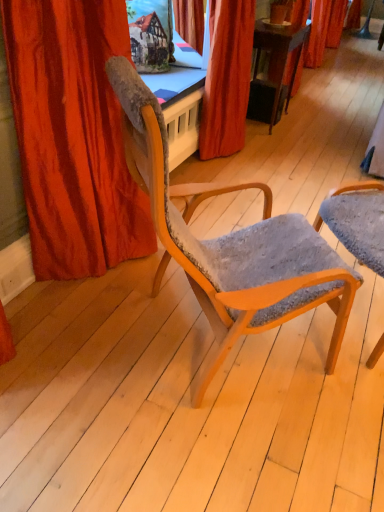
At what (x,y) coordinates should I click in order to perform the action: click on free spot below wooden chair with textured fabric at center, the 1th chair in the left-to-right sequence (from a real-world perspective). Please return your answer as a coordinate pair (x, y). Image resolution: width=384 pixels, height=512 pixels. Looking at the image, I should click on (201, 349).